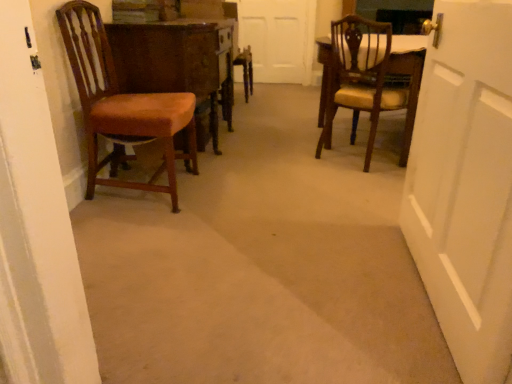
Where is `vacant region under matte brown chair at left, the 2th chair when ordered from right to left (from a real-world perspective)`? vacant region under matte brown chair at left, the 2th chair when ordered from right to left (from a real-world perspective) is located at coordinates (143, 196).